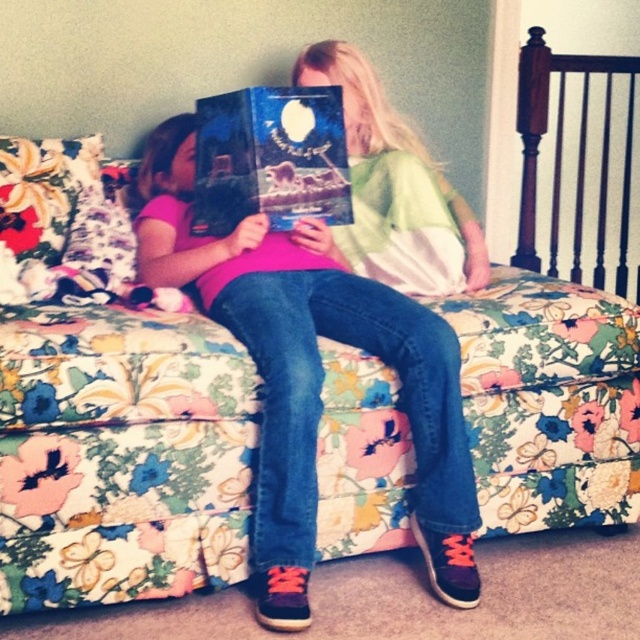
Question: Which point appears closest to the camera in this image?

Choices:
 (A) (307, 100)
 (B) (301, 262)

Answer: (A)

Question: Is pink matte shirt at center positioned in front of hardcover book at center?

Choices:
 (A) no
 (B) yes

Answer: (B)

Question: Can you confirm if pink matte shirt at center is thinner than hardcover book at center?

Choices:
 (A) no
 (B) yes

Answer: (A)

Question: Which point is closer to the camera?

Choices:
 (A) (148, 166)
 (B) (298, 140)

Answer: (B)

Question: Is pink matte shirt at center bigger than hardcover book at center?

Choices:
 (A) yes
 (B) no

Answer: (A)

Question: Which point appears farthest from the camera in this image?

Choices:
 (A) (262, 180)
 (B) (316, 310)

Answer: (B)